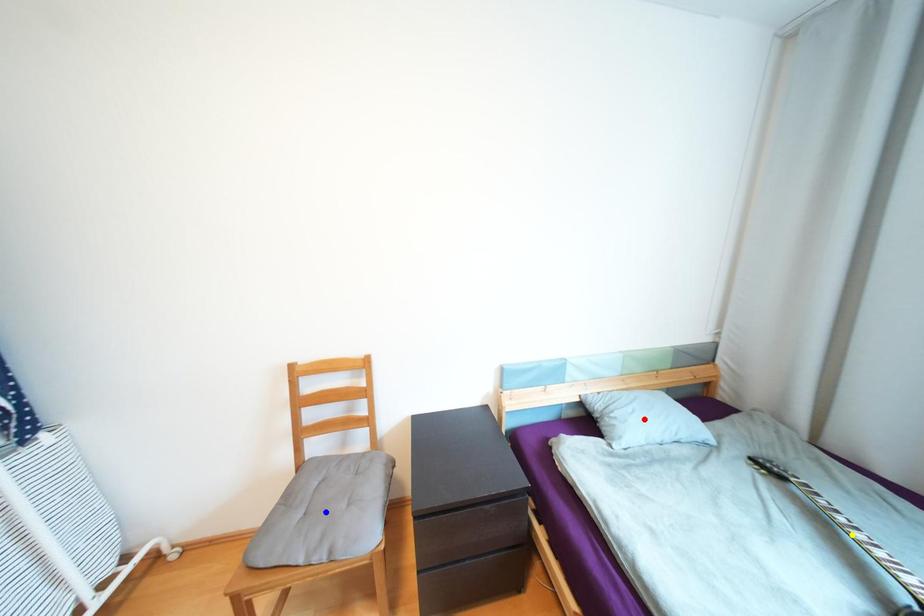
Order these from farthest to nearest:
A) yellow point
B) red point
C) blue point

1. red point
2. blue point
3. yellow point